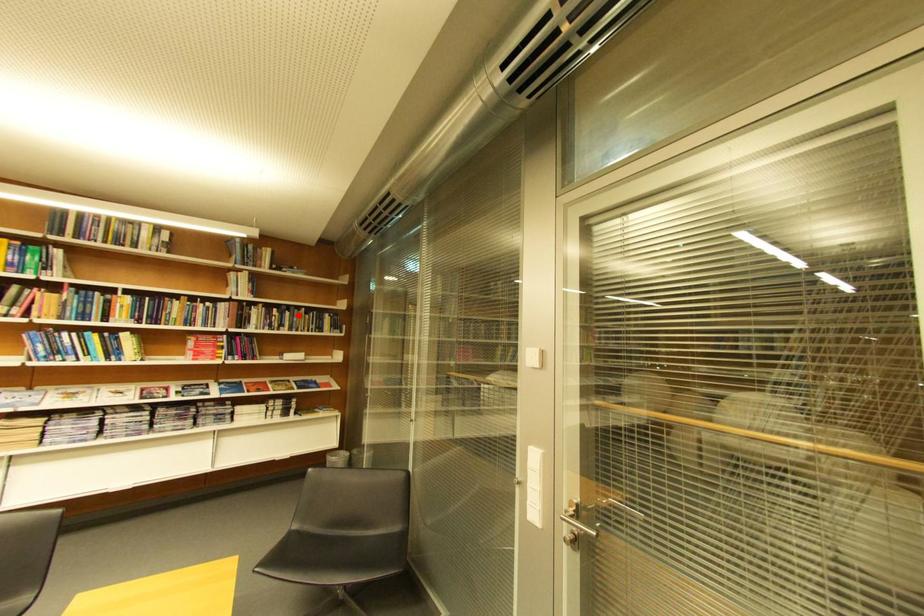
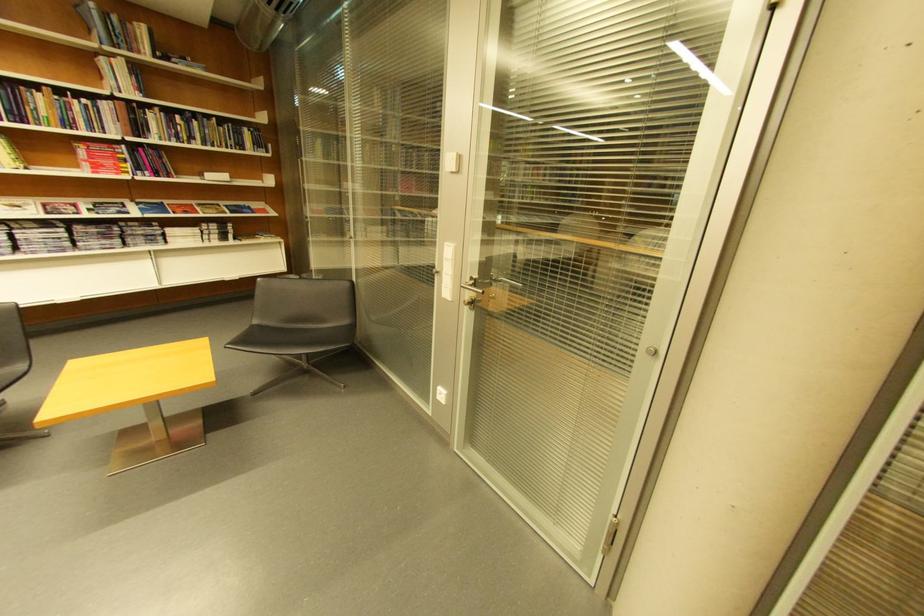
In the second image, find the point that corresponds to the highlighted location in the first image.

(205, 124)